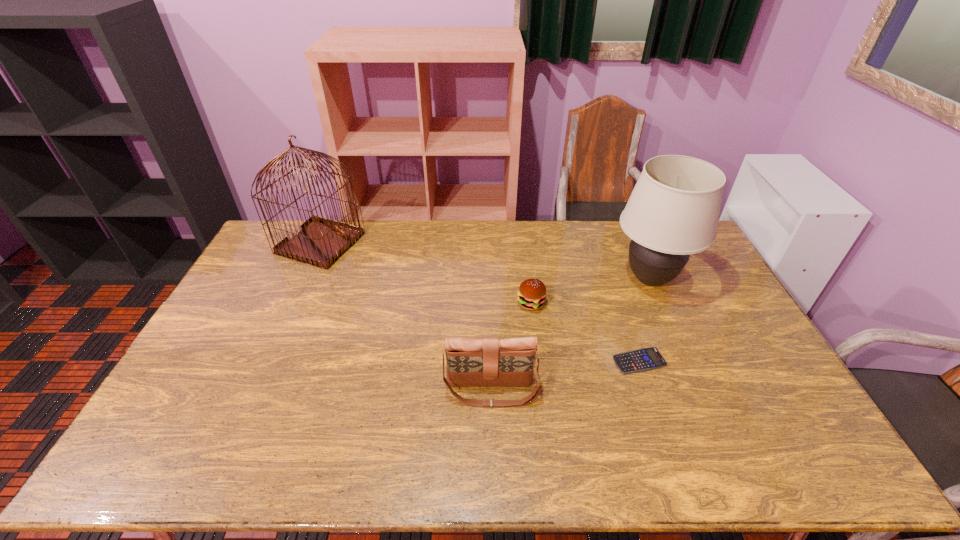
Find the location of a particular element. This screenshot has height=540, width=960. object that is the closest to the hamburger is located at coordinates (644, 359).

Find the location of a particular element. The height and width of the screenshot is (540, 960). free location that satisfies the following two spatial constraints: 1. on the back side of the hamburger; 2. on the left side of the lampshade is located at coordinates (528, 280).